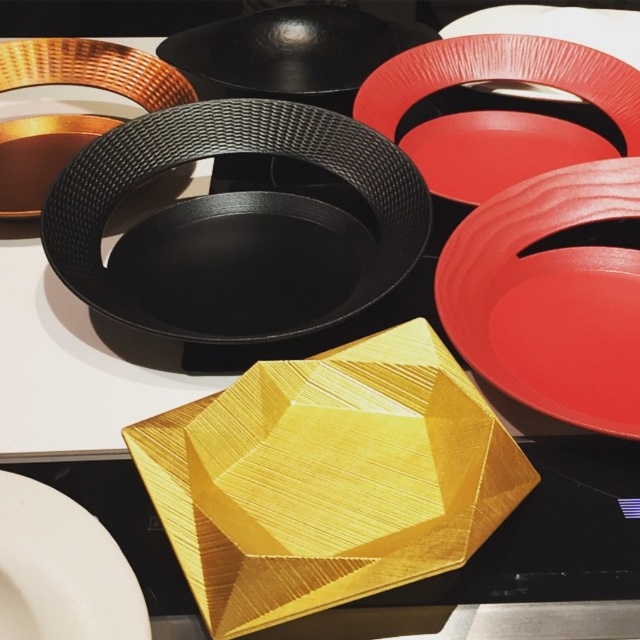
Question: Is matte red plate at right bigger than white matte plate at lower left?

Choices:
 (A) no
 (B) yes

Answer: (B)

Question: Which point appears farthest from the camera in this image?

Choices:
 (A) (625, 182)
 (B) (513, 90)
 (C) (316, 252)
 (D) (401, 68)

Answer: (B)

Question: Is black textured platter at center thinner than matte red plate at right?

Choices:
 (A) yes
 (B) no

Answer: (B)

Question: Is matte red platter at upper right wider than white matte plate at lower left?

Choices:
 (A) no
 (B) yes

Answer: (B)

Question: Based on their relative distances, which object is nearer to the matte red platter at upper right?

Choices:
 (A) matte red plate at upper right
 (B) matte red plate at right
 (C) matte black plate at upper center
 (D) black textured platter at center

Answer: (A)

Question: Estimate the real-world distances between objects in this image. Which object is farther from the matte red plate at upper right?

Choices:
 (A) black textured platter at center
 (B) matte black plate at upper center
 (C) white matte plate at lower left
 (D) matte red platter at upper right

Answer: (C)